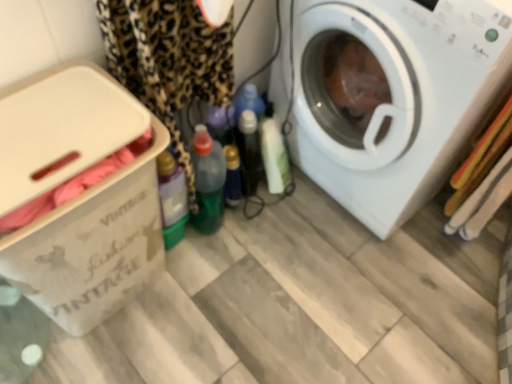
The image size is (512, 384). Describe the element at coordinates (232, 175) in the screenshot. I see `translucent plastic bottle at center, the 2th bottle positioned from the left` at that location.

Find the location of `white plastic washing machine at right`. white plastic washing machine at right is located at coordinates (390, 96).

From a real-world perspective, is green plastic bottle at center, placed as the 2th bottle when sorted from right to left, positioned under white plastic washing machine at right based on gravity?

Yes, from a real-world perspective, green plastic bottle at center, placed as the 2th bottle when sorted from right to left, is under white plastic washing machine at right.

Considering the points (223, 182) and (483, 33), which point is behind, point (223, 182) or point (483, 33)?

The point (223, 182) is more distant.

Which is in front, green plastic bottle at center, which is the 1th bottle from left to right, or white plastic washing machine at right?

white plastic washing machine at right is more forward.

Measure the distance from green plastic bottle at center, which is the 1th bottle from left to right, to white plastic washing machine at right.

green plastic bottle at center, which is the 1th bottle from left to right, is 45.54 centimeters from white plastic washing machine at right.

Where is `bottle that is above the translucent plastic bottle at center, the 1th bottle positioned from the right (from a real-world perspective)`? The height and width of the screenshot is (384, 512). bottle that is above the translucent plastic bottle at center, the 1th bottle positioned from the right (from a real-world perspective) is located at coordinates [x=208, y=181].

Looking at this image, which object is positioned more to the right, translucent plastic bottle at center, the 2th bottle positioned from the left, or green plastic bottle at center, placed as the 2th bottle when sorted from right to left?

translucent plastic bottle at center, the 2th bottle positioned from the left, is more to the right.

Who is smaller, translucent plastic bottle at center, the 2th bottle positioned from the left, or green plastic bottle at center, placed as the 2th bottle when sorted from right to left?

With smaller size is translucent plastic bottle at center, the 2th bottle positioned from the left.

Is translucent plastic bottle at center, the 1th bottle positioned from the right, touching green plastic bottle at center, placed as the 2th bottle when sorted from right to left?

No, translucent plastic bottle at center, the 1th bottle positioned from the right, is not touching green plastic bottle at center, placed as the 2th bottle when sorted from right to left.

Is there a large distance between white plastic washing machine at right and green plastic bottle at center, which is the 1th bottle from left to right?

No, white plastic washing machine at right is in close proximity to green plastic bottle at center, which is the 1th bottle from left to right.

From the image's perspective, is white plastic washing machine at right above or below green plastic bottle at center, which is the 1th bottle from left to right?

white plastic washing machine at right is situated higher than green plastic bottle at center, which is the 1th bottle from left to right, in the image.

How distant is white plastic washing machine at right from green plastic bottle at center, which is the 1th bottle from left to right?

white plastic washing machine at right is 17.93 inches away from green plastic bottle at center, which is the 1th bottle from left to right.

Based on the photo, from a real-world perspective, is white plastic washing machine at right positioned above or below green plastic bottle at center, placed as the 2th bottle when sorted from right to left?

white plastic washing machine at right is above green plastic bottle at center, placed as the 2th bottle when sorted from right to left.

This screenshot has width=512, height=384. I want to click on clothing on the right of the beige cardboard box at left, so click(168, 61).

Considering the positions of points (84, 160) and (159, 115), is point (84, 160) closer to camera compared to point (159, 115)?

Yes, point (84, 160) is in front of point (159, 115).

From a real-world perspective, is beige cardboard box at left positioned above or below leopard print fabric at left?

From a real-world perspective, beige cardboard box at left is physically below leopard print fabric at left.

Which object is further away from the camera taking this photo, beige cardboard box at left or leopard print fabric at left?

leopard print fabric at left is further from the camera.

From the image's perspective, is leopard print fabric at left located beneath green plastic bottle at center, which is the 1th bottle from left to right?

No, from the image's perspective, leopard print fabric at left is not below green plastic bottle at center, which is the 1th bottle from left to right.

From the picture: Which is nearer, (219, 98) or (199, 129)?

The point (219, 98) is more forward.

From a real-world perspective, is leopard print fabric at left positioned above or below green plastic bottle at center, placed as the 2th bottle when sorted from right to left?

Clearly, from a real-world perspective, leopard print fabric at left is above green plastic bottle at center, placed as the 2th bottle when sorted from right to left.

Is leopard print fabric at left spatially inside green plastic bottle at center, which is the 1th bottle from left to right, or outside of it?

leopard print fabric at left exists outside the volume of green plastic bottle at center, which is the 1th bottle from left to right.

Which object is thinner, beige cardboard box at left or green plastic bottle at center, placed as the 2th bottle when sorted from right to left?

green plastic bottle at center, placed as the 2th bottle when sorted from right to left, is thinner.

Is beige cardboard box at left in front of or behind green plastic bottle at center, which is the 1th bottle from left to right, in the image?

In the image, beige cardboard box at left appears in front of green plastic bottle at center, which is the 1th bottle from left to right.

Is beige cardboard box at left positioned far away from green plastic bottle at center, which is the 1th bottle from left to right?

Actually, beige cardboard box at left and green plastic bottle at center, which is the 1th bottle from left to right, are a little close together.

Is beige cardboard box at left turned away from green plastic bottle at center, placed as the 2th bottle when sorted from right to left?

No, beige cardboard box at left's orientation is not away from green plastic bottle at center, placed as the 2th bottle when sorted from right to left.

From a real-world perspective, between leopard print fabric at left and translucent plastic bottle at center, the 1th bottle positioned from the right, who is vertically higher?

leopard print fabric at left.

How many degrees apart are the facing directions of leopard print fabric at left and translucent plastic bottle at center, the 1th bottle positioned from the right?

75.4 degrees.

Does leopard print fabric at left appear on the left side of translucent plastic bottle at center, the 2th bottle positioned from the left?

Yes, leopard print fabric at left is to the left of translucent plastic bottle at center, the 2th bottle positioned from the left.

From the image's perspective, between leopard print fabric at left and translucent plastic bottle at center, the 1th bottle positioned from the right, which one is located above?

From the image's view, leopard print fabric at left is above.

You are a GUI agent. You are given a task and a screenshot of the screen. Output one action in this format:
    pyautogui.click(x=<x>, y=<y>)
    Task: Click on the bottle that is the 1st one when counting backward from the white plastic washing machine at right
    
    Given the screenshot: What is the action you would take?
    pyautogui.click(x=208, y=181)

Where is `bottle below the green plastic bottle at center, placed as the 2th bottle when sorted from right to left (from a real-world perspective)`? The height and width of the screenshot is (384, 512). bottle below the green plastic bottle at center, placed as the 2th bottle when sorted from right to left (from a real-world perspective) is located at coordinates (232, 175).

Based on the photo, which object lies further to the anchor point white plastic washing machine at right, leopard print fabric at left or translucent plastic bottle at center, the 2th bottle positioned from the left?

translucent plastic bottle at center, the 2th bottle positioned from the left, is positioned further to the anchor white plastic washing machine at right.

From the image, which object appears to be nearer to green plastic bottle at center, placed as the 2th bottle when sorted from right to left, translucent plastic bottle at center, the 1th bottle positioned from the right, or leopard print fabric at left?

Among the two, translucent plastic bottle at center, the 1th bottle positioned from the right, is located nearer to green plastic bottle at center, placed as the 2th bottle when sorted from right to left.

Consider the image. Considering their positions, is translucent plastic bottle at center, the 1th bottle positioned from the right, positioned further to leopard print fabric at left than beige cardboard box at left?

translucent plastic bottle at center, the 1th bottle positioned from the right, is positioned further to the anchor leopard print fabric at left.

Considering their positions, is translucent plastic bottle at center, the 1th bottle positioned from the right, positioned closer to beige cardboard box at left than leopard print fabric at left?

leopard print fabric at left.

When comparing their distances from white plastic washing machine at right, does leopard print fabric at left or green plastic bottle at center, which is the 1th bottle from left to right, seem closer?

Among the two, leopard print fabric at left is located nearer to white plastic washing machine at right.

Based on their spatial positions, is green plastic bottle at center, which is the 1th bottle from left to right, or leopard print fabric at left closer to white plastic washing machine at right?

leopard print fabric at left lies closer to white plastic washing machine at right than the other object.

Considering their positions, is white plastic washing machine at right positioned closer to translucent plastic bottle at center, the 1th bottle positioned from the right, than beige cardboard box at left?

Result: The object closer to translucent plastic bottle at center, the 1th bottle positioned from the right, is white plastic washing machine at right.

Based on their spatial positions, is green plastic bottle at center, which is the 1th bottle from left to right, or translucent plastic bottle at center, the 2th bottle positioned from the left, closer to leopard print fabric at left?

Among the two, green plastic bottle at center, which is the 1th bottle from left to right, is located nearer to leopard print fabric at left.

Find the location of a particular element. This screenshot has height=384, width=512. bottle located between beige cardboard box at left and translucent plastic bottle at center, the 2th bottle positioned from the left, in the depth direction is located at coordinates (208, 181).

Identify the location of bottle located between green plastic bottle at center, placed as the 2th bottle when sorted from right to left, and white plastic washing machine at right in the left-right direction. (232, 175).

Identify the location of clothing between beige cardboard box at left and green plastic bottle at center, which is the 1th bottle from left to right, along the z-axis. This screenshot has width=512, height=384. (168, 61).

Where is `bottle between leopard print fabric at left and translucent plastic bottle at center, the 1th bottle positioned from the right, in the front-back direction`? This screenshot has width=512, height=384. bottle between leopard print fabric at left and translucent plastic bottle at center, the 1th bottle positioned from the right, in the front-back direction is located at coordinates (208, 181).